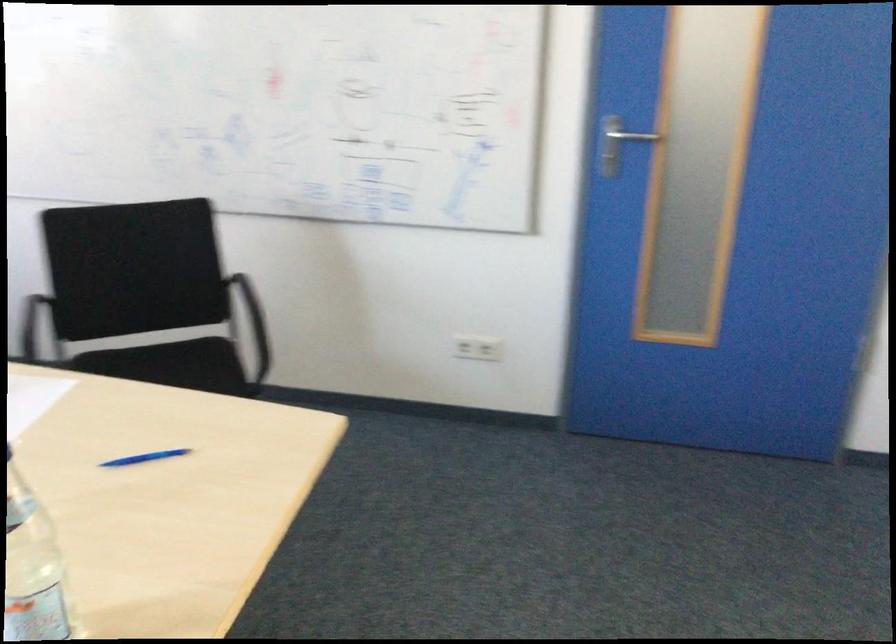
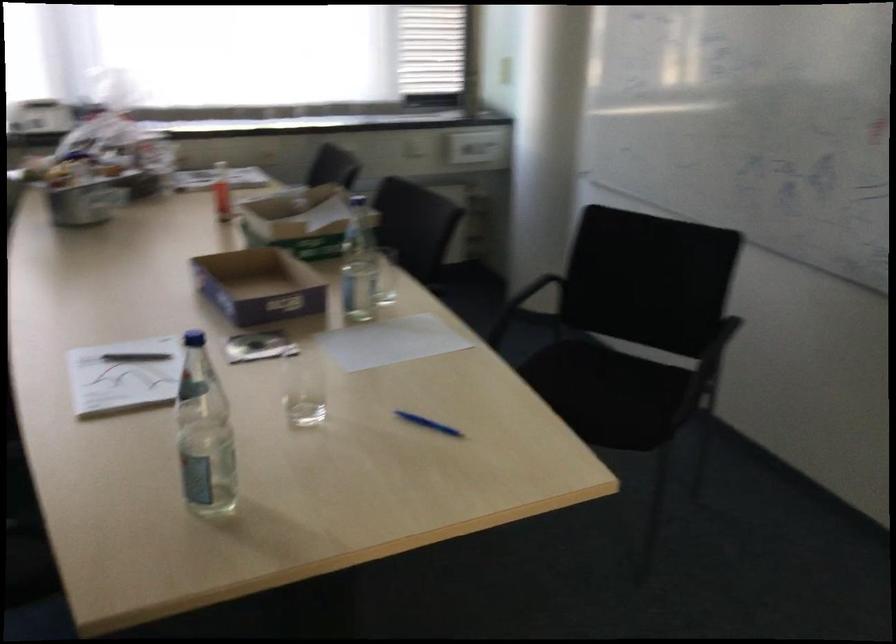
Question: The images are taken continuously from a first-person perspective. In which direction is your viewpoint rotating?

Choices:
 (A) Left
 (B) Right
 (C) Up
 (D) Down

Answer: (A)